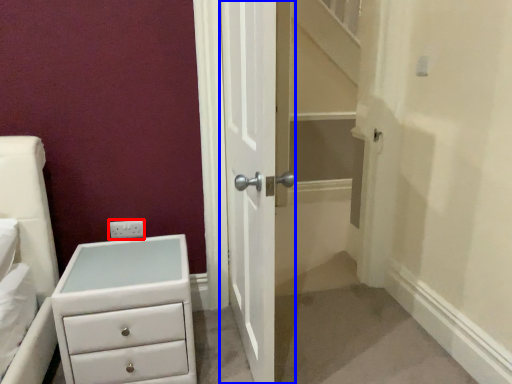
Question: Which object appears closest to the camera in this image, electric outlet (highlighted by a red box) or door (highlighted by a blue box)?

Choices:
 (A) electric outlet
 (B) door

Answer: (B)